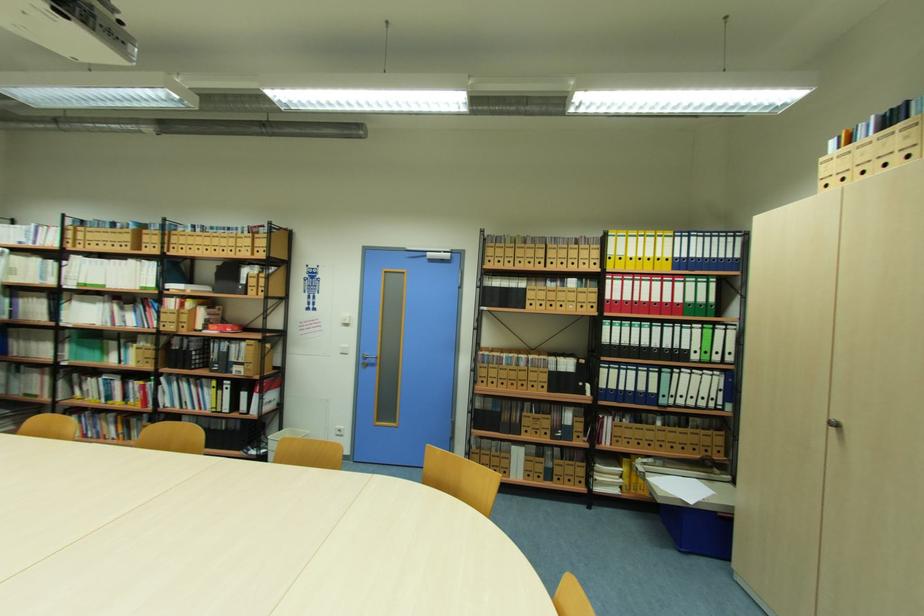
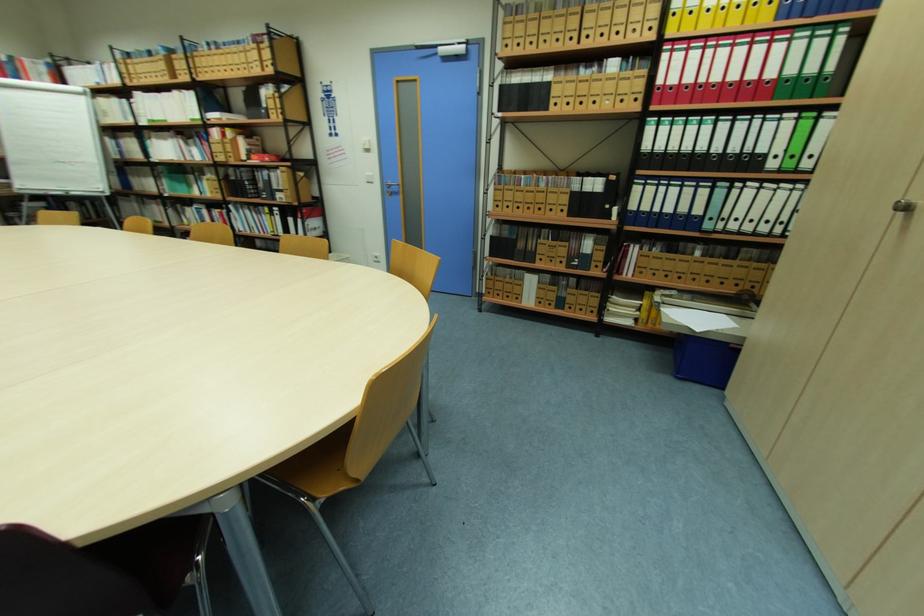
Question: The images are taken continuously from a first-person perspective. In which direction are you moving?

Choices:
 (A) Left
 (B) Right
 (C) Forward
 (D) Backward

Answer: (B)